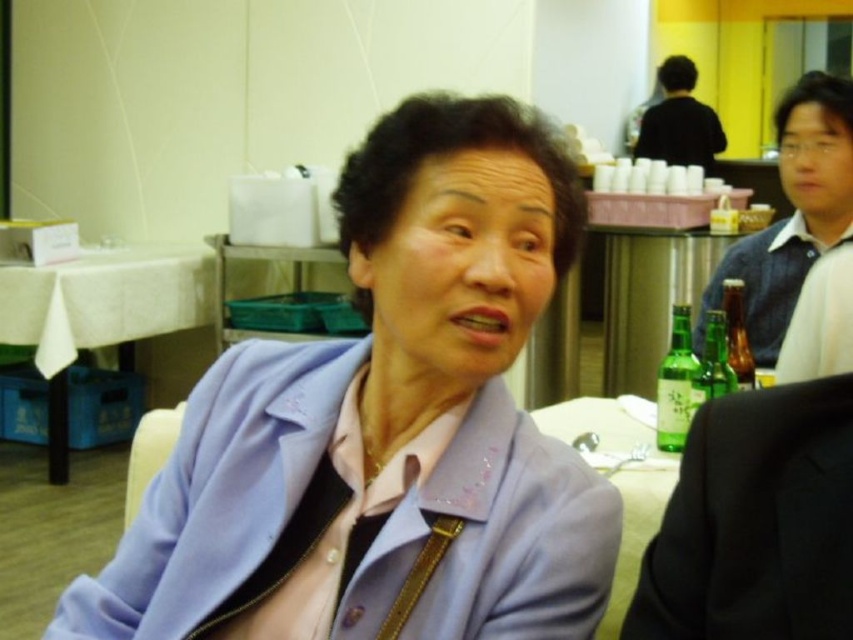
Is white glossy table at center to the right of black matte shirt at upper center from the viewer's perspective?

Incorrect, white glossy table at center is not on the right side of black matte shirt at upper center.

Does white glossy table at center appear over black matte shirt at upper center?

Actually, white glossy table at center is below black matte shirt at upper center.

Is point (631, 516) more distant than point (686, 150)?

No.

Where is `white glossy table at center`? The image size is (853, 640). white glossy table at center is located at coordinates (619, 483).

Is point (36, 316) less distant than point (647, 140)?

That is True.

Which is behind, point (177, 288) or point (659, 122)?

The point (659, 122) is more distant.

Who is more forward, (26,321) or (672,99)?

Positioned in front is point (26,321).

You are a GUI agent. You are given a task and a screenshot of the screen. Output one action in this format:
    pyautogui.click(x=<x>, y=<y>)
    Task: Click on the white cloth at center
    The height and width of the screenshot is (640, 853).
    Given the screenshot: What is the action you would take?
    pyautogui.click(x=102, y=310)

Describe the element at coordinates (386, 426) in the screenshot. I see `purple fabric jacket at center` at that location.

Is purple fabric jacket at center wider than white cloth at center?

No, purple fabric jacket at center is not wider than white cloth at center.

Is point (415, 394) positioned before point (115, 317)?

Yes, point (415, 394) is closer to viewer.

The image size is (853, 640). I want to click on purple fabric jacket at center, so click(x=386, y=426).